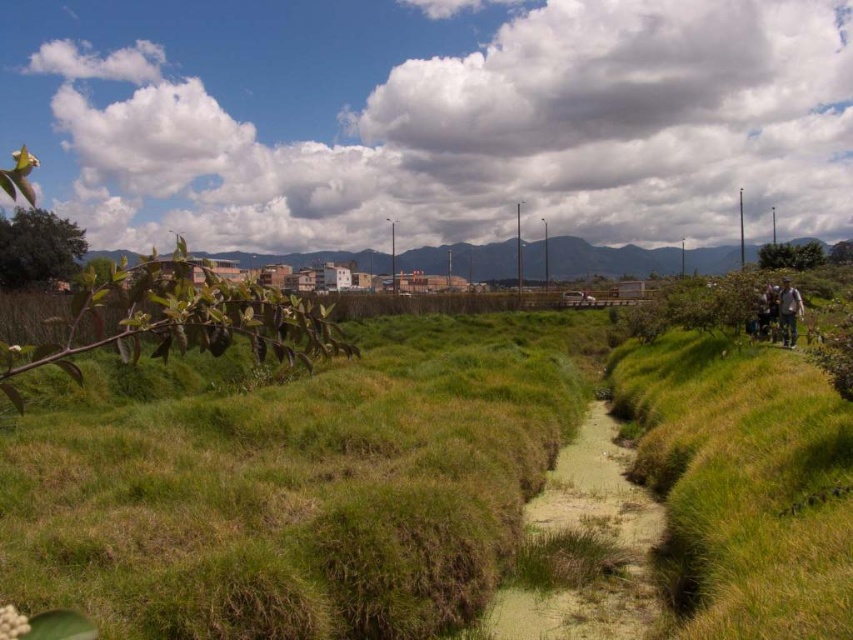
You are standing at the point marked by the coordinates point (x=607, y=259) in the image. Looking around, what do you see immediately around you?

You are standing on the green grassy hill at center marked by the coordinates point (x=607, y=259).

You are a hiker who wants to place your camouflage fabric jacket at right on a surface that is higher than the ground level. Is the green grassy hill at center a suitable spot for this?

The green grassy hill at center is located above the camouflage fabric jacket at right, so placing the camouflage fabric jacket at right on the green grassy hill at center would position it higher than ground level, making it a suitable spot.

You are a hiker who wants to place your camouflage fabric jacket at right on the green grassy hill at center. Is this possible based on their positions?

The green grassy hill at center is to the left of the camouflage fabric jacket at right, so you can move the camouflage fabric jacket at right to the left to place it on the green grassy hill at center.